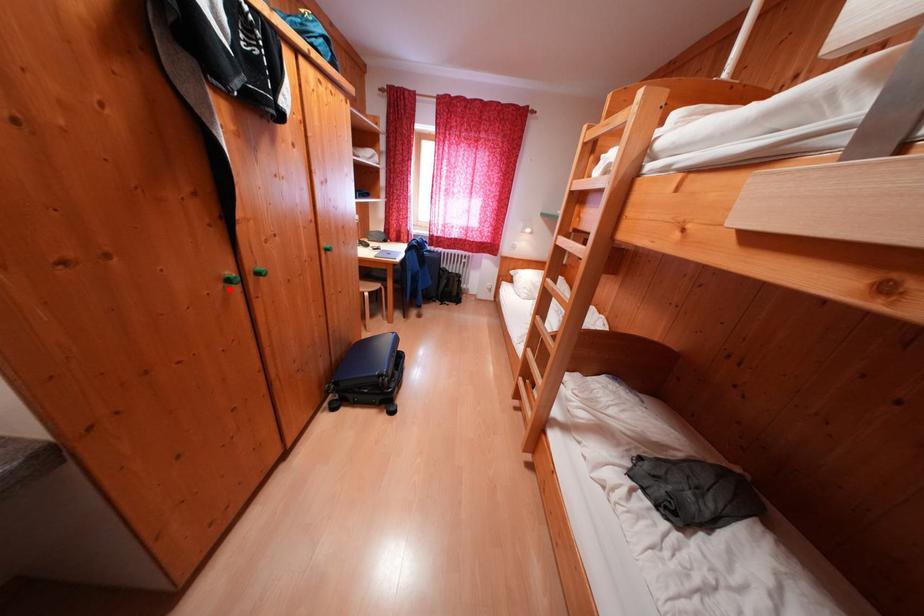
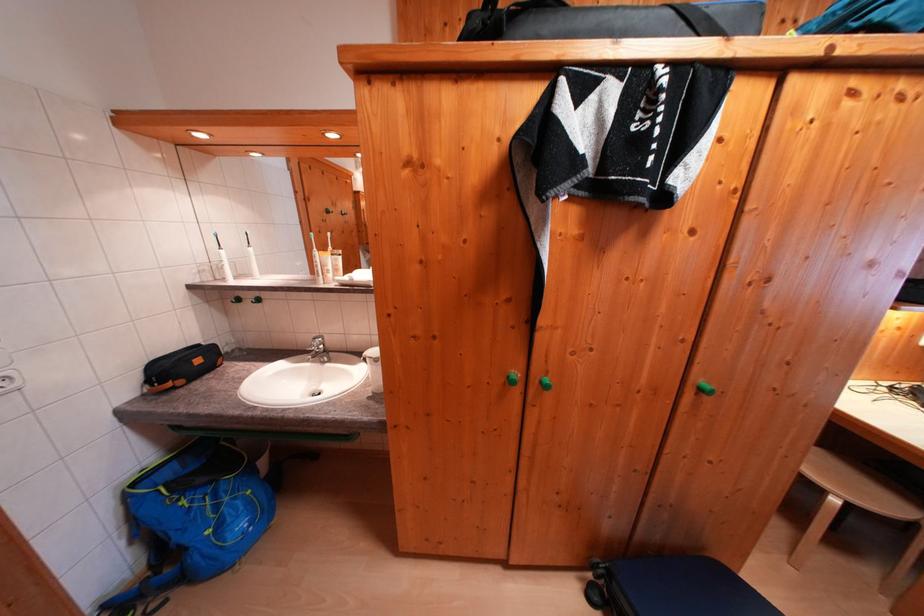
The point at the highlighted location is marked in the first image. Where is the corresponding point in the second image?

(511, 384)